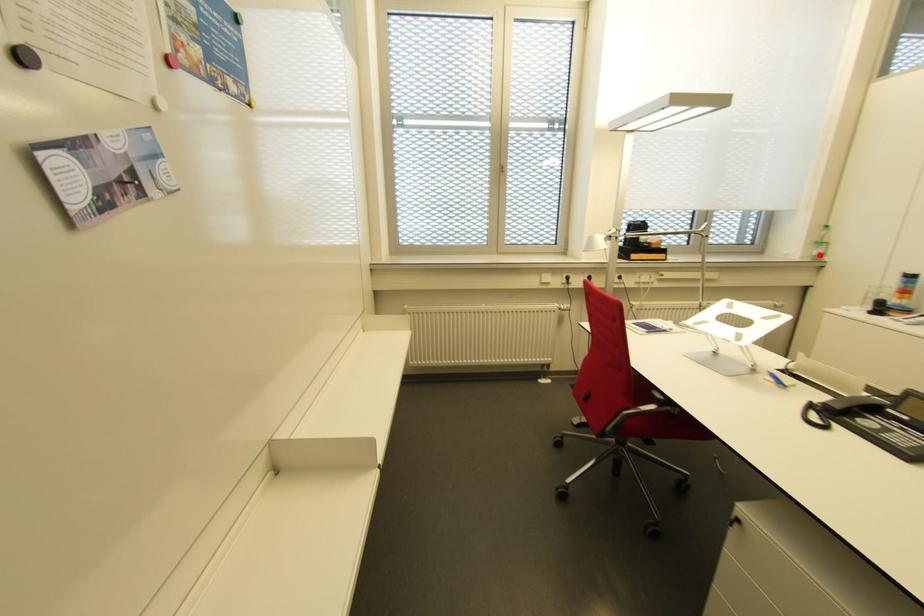
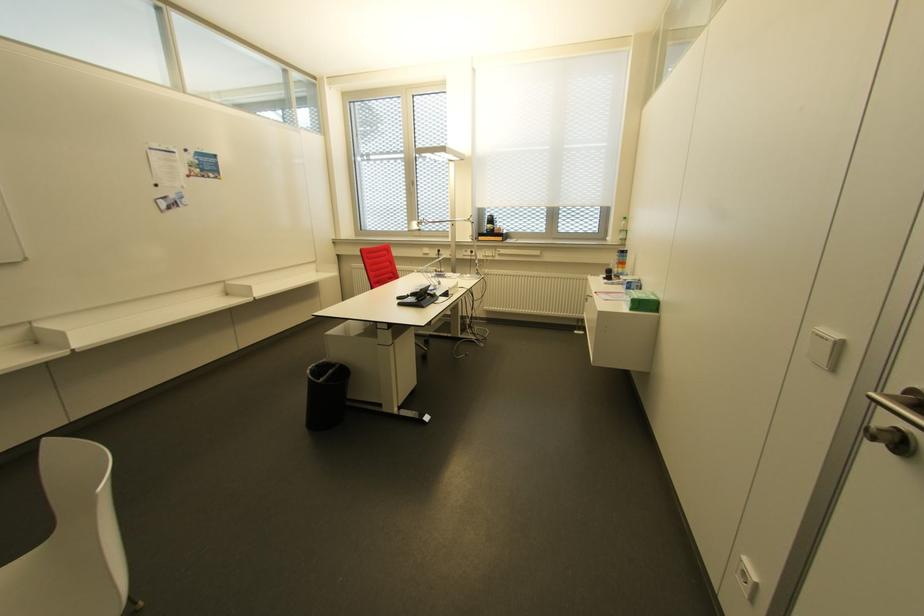
In the second image, find the point that corresponds to the highlighted location in the first image.

(623, 240)